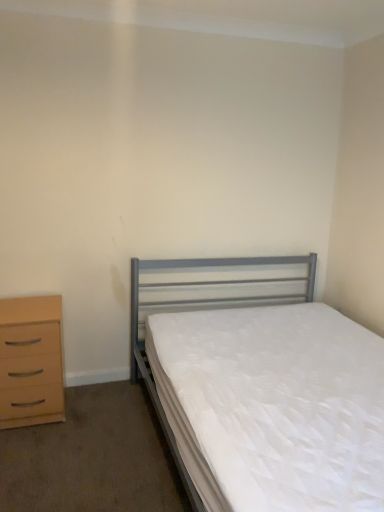
What do you see at coordinates (31, 361) in the screenshot? The height and width of the screenshot is (512, 384). I see `light wood/texture chest of drawers at left` at bounding box center [31, 361].

You are a GUI agent. You are given a task and a screenshot of the screen. Output one action in this format:
    pyautogui.click(x=<x>, y=<y>)
    Task: Click on the light wood/texture chest of drawers at left
    The width and height of the screenshot is (384, 512).
    Given the screenshot: What is the action you would take?
    pyautogui.click(x=31, y=361)

Consider the image. In order to face light wood/texture chest of drawers at left, should I rotate leftwards or rightwards?

You should look left and rotate roughly 20.851 degrees.

What do you see at coordinates (262, 389) in the screenshot? The height and width of the screenshot is (512, 384). I see `metallic gray bed at center` at bounding box center [262, 389].

You are a GUI agent. You are given a task and a screenshot of the screen. Output one action in this format:
    pyautogui.click(x=<x>, y=<y>)
    Task: Click on the metallic gray bed at center
    The height and width of the screenshot is (512, 384).
    Given the screenshot: What is the action you would take?
    pyautogui.click(x=262, y=389)

What are the coordinates of `light wood/texture chest of drawers at left` in the screenshot? It's located at (31, 361).

Which is more to the left, metallic gray bed at center or light wood/texture chest of drawers at left?

Positioned to the left is light wood/texture chest of drawers at left.

Which object is closer to the camera taking this photo, metallic gray bed at center or light wood/texture chest of drawers at left?

metallic gray bed at center is closer to the camera.

Considering the positions of points (272, 470) and (16, 353), is point (272, 470) closer to camera compared to point (16, 353)?

Yes, point (272, 470) is in front of point (16, 353).

From the image's perspective, which one is positioned higher, metallic gray bed at center or light wood/texture chest of drawers at left?

metallic gray bed at center.

From a real-world perspective, between metallic gray bed at center and light wood/texture chest of drawers at left, who is vertically lower?

In real-world perspective, light wood/texture chest of drawers at left is lower.

In the scene shown: Looking at their sizes, would you say metallic gray bed at center is wider or thinner than light wood/texture chest of drawers at left?

metallic gray bed at center is wider than light wood/texture chest of drawers at left.

Based on the photo, from their relative heights in the image, would you say metallic gray bed at center is taller or shorter than light wood/texture chest of drawers at left?

Considering their sizes, metallic gray bed at center has more height than light wood/texture chest of drawers at left.

Can you confirm if metallic gray bed at center is bigger than light wood/texture chest of drawers at left?

Indeed, metallic gray bed at center has a larger size compared to light wood/texture chest of drawers at left.

Would you say metallic gray bed at center is inside or outside light wood/texture chest of drawers at left?

metallic gray bed at center is outside light wood/texture chest of drawers at left.

Is metallic gray bed at center with light wood/texture chest of drawers at left?

No, metallic gray bed at center is not making contact with light wood/texture chest of drawers at left.

Is metallic gray bed at center aimed at light wood/texture chest of drawers at left?

Answer: No, metallic gray bed at center does not turn towards light wood/texture chest of drawers at left.

Measure the distance from metallic gray bed at center to light wood/texture chest of drawers at left.

metallic gray bed at center and light wood/texture chest of drawers at left are 94.63 centimeters apart from each other.

Find the location of `bed on the right side of light wood/texture chest of drawers at left`. bed on the right side of light wood/texture chest of drawers at left is located at coordinates (262, 389).

In the image, is light wood/texture chest of drawers at left on the left side or the right side of metallic gray bed at center?

Clearly, light wood/texture chest of drawers at left is on the left of metallic gray bed at center in the image.

Considering the positions of objects light wood/texture chest of drawers at left and metallic gray bed at center in the image provided, who is in front, light wood/texture chest of drawers at left or metallic gray bed at center?

metallic gray bed at center is more forward.

Which is nearer, (x=3, y=409) or (x=376, y=423)?

Point (x=3, y=409) is positioned farther from the camera compared to point (x=376, y=423).

From the image's perspective, is light wood/texture chest of drawers at left located above metallic gray bed at center?

No, from the image's perspective, light wood/texture chest of drawers at left is not above metallic gray bed at center.

From a real-world perspective, who is located lower, light wood/texture chest of drawers at left or metallic gray bed at center?

light wood/texture chest of drawers at left is physically lower.

Does light wood/texture chest of drawers at left have a greater width compared to metallic gray bed at center?

Incorrect, the width of light wood/texture chest of drawers at left does not surpass that of metallic gray bed at center.

Looking at this image, considering the relative sizes of light wood/texture chest of drawers at left and metallic gray bed at center in the image provided, is light wood/texture chest of drawers at left shorter than metallic gray bed at center?

Yes, light wood/texture chest of drawers at left is shorter than metallic gray bed at center.

Does light wood/texture chest of drawers at left have a larger size compared to metallic gray bed at center?

No.

Is metallic gray bed at center a part of light wood/texture chest of drawers at left?

That's incorrect, metallic gray bed at center is not inside light wood/texture chest of drawers at left.

Would you say light wood/texture chest of drawers at left is a long distance from metallic gray bed at center?

No, there isn't a large distance between light wood/texture chest of drawers at left and metallic gray bed at center.

Is metallic gray bed at center at the back of light wood/texture chest of drawers at left?

No, light wood/texture chest of drawers at left's orientation is not away from metallic gray bed at center.

What's the angular difference between light wood/texture chest of drawers at left and metallic gray bed at center's facing directions?

light wood/texture chest of drawers at left and metallic gray bed at center are facing 1.87 degrees away from each other.

How much distance is there between light wood/texture chest of drawers at left and metallic gray bed at center?

light wood/texture chest of drawers at left is 37.26 inches away from metallic gray bed at center.

Where is `bed on the right side of light wood/texture chest of drawers at left`? This screenshot has width=384, height=512. bed on the right side of light wood/texture chest of drawers at left is located at coordinates (262, 389).

Where is `bed above the light wood/texture chest of drawers at left (from a real-world perspective)`? bed above the light wood/texture chest of drawers at left (from a real-world perspective) is located at coordinates (262, 389).

I want to click on chest of drawers below the metallic gray bed at center (from the image's perspective), so click(x=31, y=361).